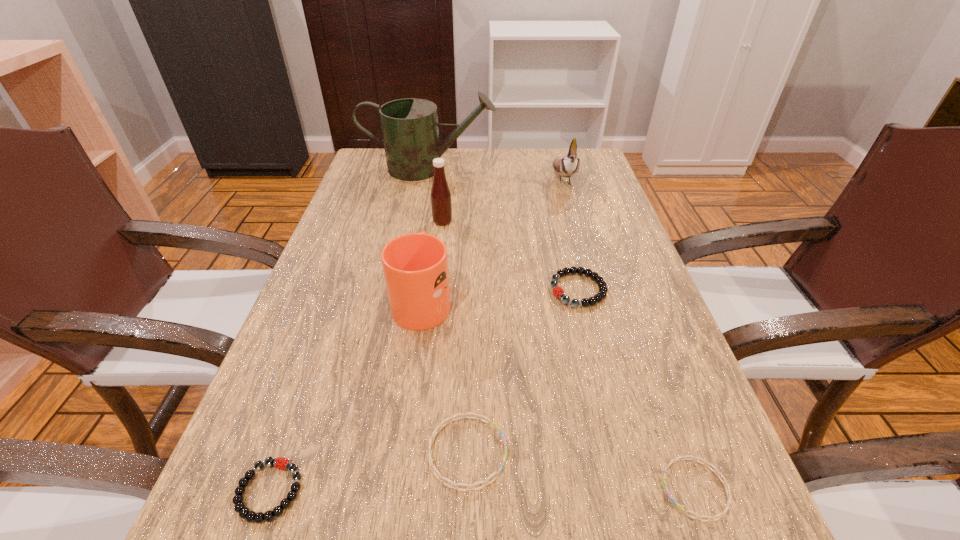
You are a GUI agent. You are given a task and a screenshot of the screen. Output one action in this format:
    pyautogui.click(x=<x>, y=<y>)
    Task: Click on the watering can
    This screenshot has width=960, height=540.
    Given the screenshot: What is the action you would take?
    pyautogui.click(x=410, y=131)

Image resolution: width=960 pixels, height=540 pixels. I want to click on the tallest object, so click(410, 131).

I want to click on white Tabasco sauce, so (441, 205).

Find the location of a particular element. Image resolution: width=960 pixels, height=540 pixels. the third farthest object is located at coordinates (441, 205).

The image size is (960, 540). Find the location of `bird`. bird is located at coordinates (566, 166).

Locate an element on the screen. The width and height of the screenshot is (960, 540). orange mug is located at coordinates coord(415,265).

Where is `the fifth tallest object`? The image size is (960, 540). the fifth tallest object is located at coordinates (556, 289).

Where is `the farther black bracelet`? the farther black bracelet is located at coordinates (556, 289).

Identify the location of the bigger blue bracelet. The width and height of the screenshot is (960, 540). (463, 415).

You are a GUI agent. You are given a task and a screenshot of the screen. Output one action in this format:
    pyautogui.click(x=<x>, y=<y>)
    Task: Click on the left blue bracelet
    The height and width of the screenshot is (540, 960).
    Given the screenshot: What is the action you would take?
    pyautogui.click(x=463, y=415)